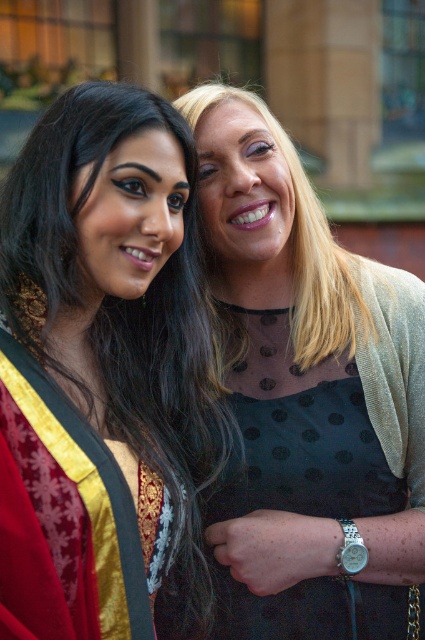
You are taking a photo of two people in an urban setting. You want to focus on the person at point (14, 634) and the person at point (365, 424). Which of these two points is closer to the camera?

Point (14, 634) is closer to the camera than point (365, 424).

You are a photographer trying to capture a clear photo of both the matte black dress at center and the black dotted dress at center. Since the camera can only focus on one height at a time, which dress should you adjust the focus to ensure both are in focus?

The matte black dress at center is not as tall as black dotted dress at center, so you should set the focus to the height of the black dotted dress at center to include both in focus.

You are a photographer trying to capture a clear shot of both the matte black dress at center and the black dotted dress at center. Since they are overlapping, which dress should you focus on to ensure the other is visible behind it?

The matte black dress at center is positioned over black dotted dress at center, so focusing on the matte black dress at center will allow the black dotted dress at center to be visible behind it.